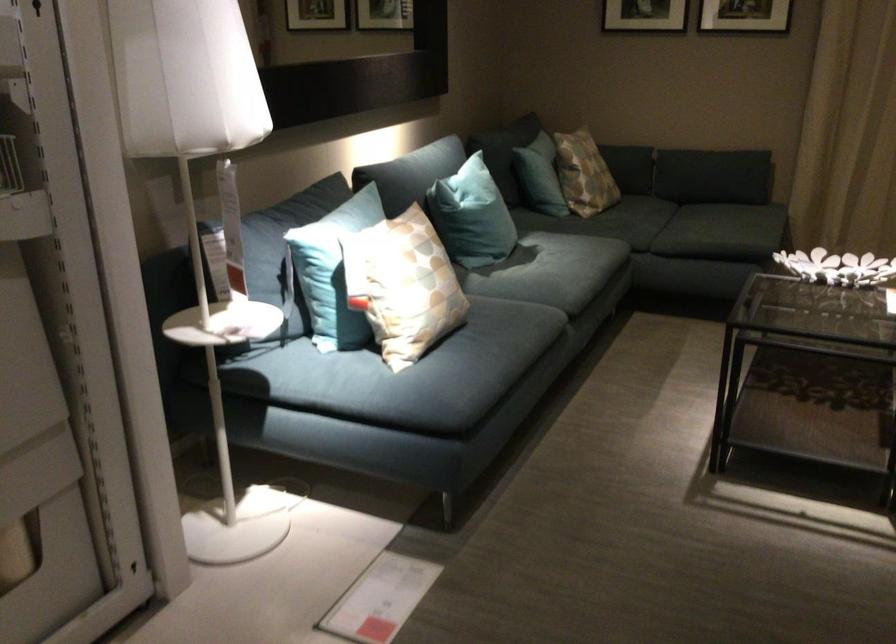
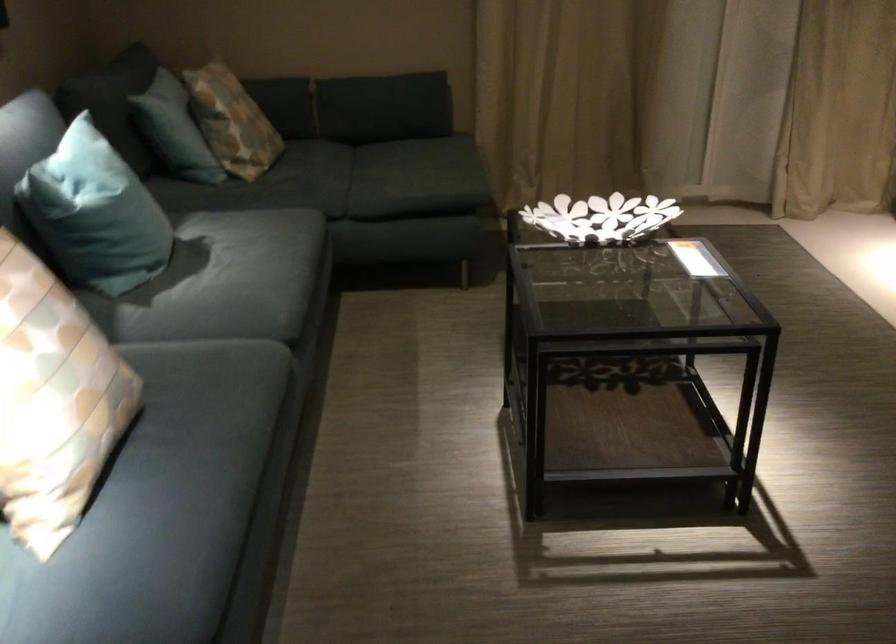
In the second image, find the point that corresponds to pixel 468 207 in the first image.

(95, 214)